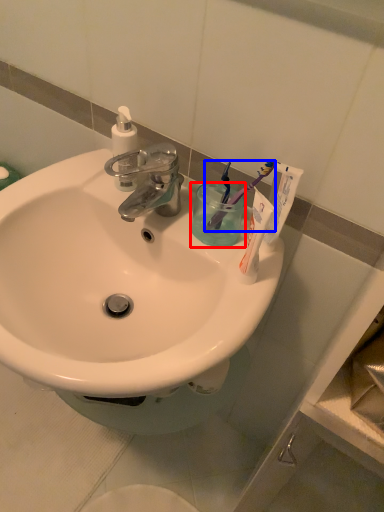
Question: Which of the following is the farthest to the observer, liquid (highlighted by a red box) or toothbrush (highlighted by a blue box)?

Choices:
 (A) liquid
 (B) toothbrush

Answer: (A)